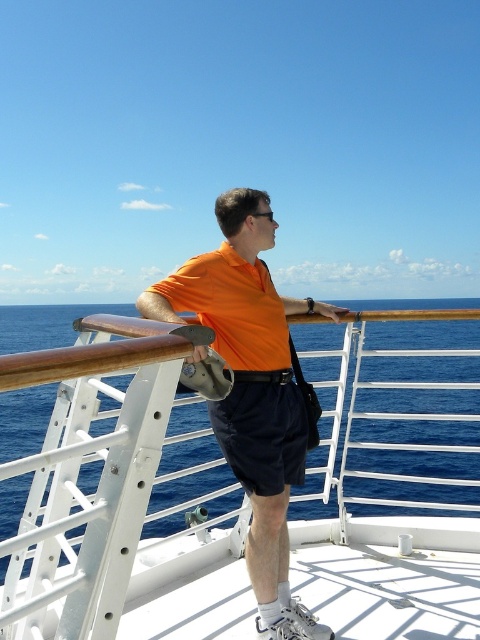
Between blue water at center and orange matte shirt at center, which one has more height?

blue water at center

Is blue water at center bigger than orange matte shirt at center?

Correct, blue water at center is larger in size than orange matte shirt at center.

What do you see at coordinates (106, 449) in the screenshot? This screenshot has width=480, height=640. I see `blue water at center` at bounding box center [106, 449].

This screenshot has height=640, width=480. Find the location of `blue water at center`. blue water at center is located at coordinates tap(106, 449).

Image resolution: width=480 pixels, height=640 pixels. Find the location of `orange matte shirt at center`. orange matte shirt at center is located at coordinates (252, 390).

Who is taller, orange matte shirt at center or navy blue shorts at center?

orange matte shirt at center

Describe the element at coordinates (252, 390) in the screenshot. I see `orange matte shirt at center` at that location.

The height and width of the screenshot is (640, 480). What are the coordinates of `orange matte shirt at center` in the screenshot? It's located at (252, 390).

Is blue water at center smaller than navy blue shorts at center?

No.

Is point (100, 372) positioned after point (275, 422)?

No, it is in front of (275, 422).

Does point (439, 460) lie behind point (242, 401)?

That is True.

Where is `blue water at center`? Image resolution: width=480 pixels, height=640 pixels. blue water at center is located at coordinates (106, 449).